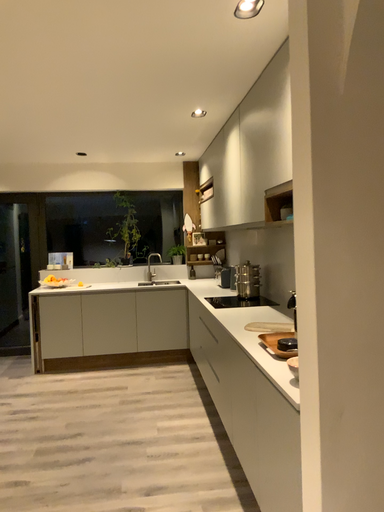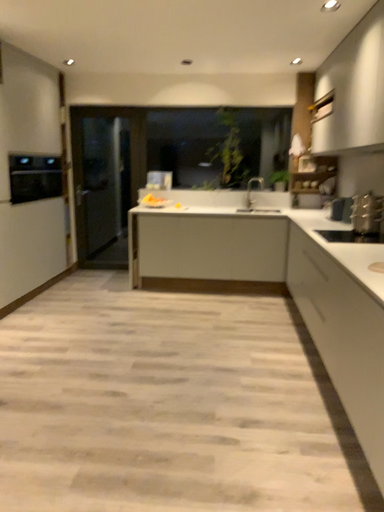
Question: Which way did the camera rotate in the video?

Choices:
 (A) rotated upward
 (B) rotated downward

Answer: (B)